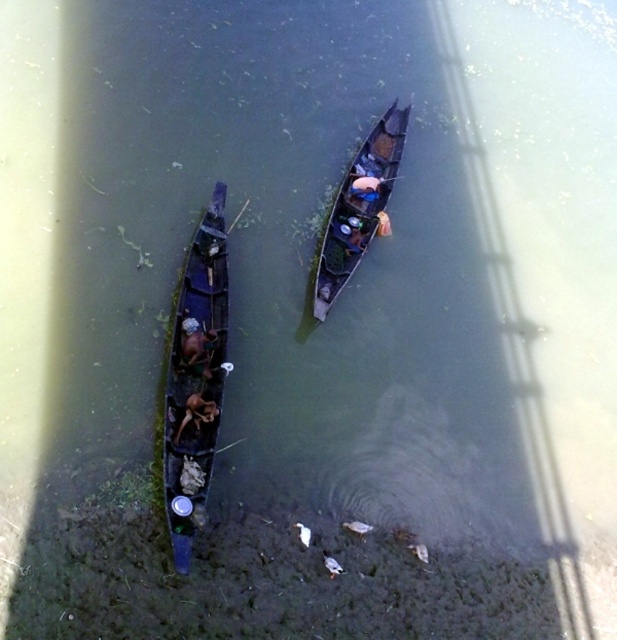
You are standing on the shore and see the dark wood canoe at left and the dark brown wooden boat at center. Which one is positioned more to the left side of the scene?

The dark wood canoe at left is positioned more to the left side of the scene than the dark brown wooden boat at center.

You are standing on the shore and want to board one of the boats. Which boat is closer to you, the dark wood boat at center or the dark brown wooden boat at center?

The dark wood boat at center is closer to you because the dark brown wooden boat at center is behind it.